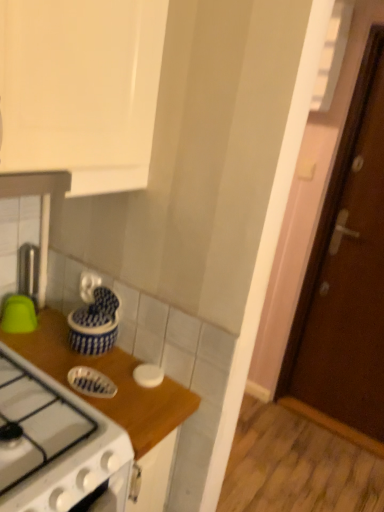
In order to click on vacant space in front of brown wooden door at right in this screenshot , I will do `click(336, 463)`.